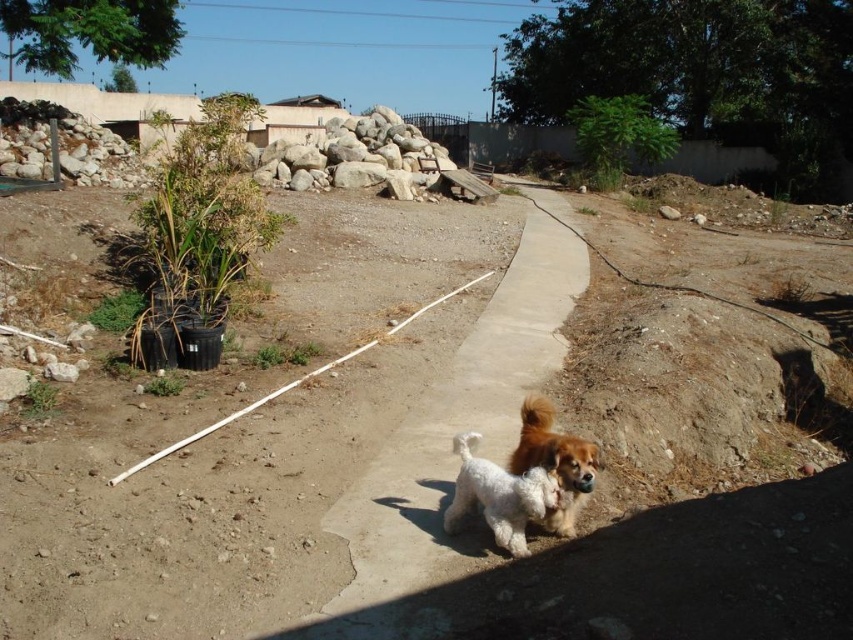
Who is more forward, (492,392) or (595,472)?

Point (595,472)

Is point (553, 266) farther from camera compared to point (535, 433)?

Yes, it is behind point (535, 433).

Locate an element on the screen. concrete at center is located at coordinates (451, 436).

Who is positioned more to the right, white fluffy dog at center or fluffy brown and white dog at center?

Positioned to the right is fluffy brown and white dog at center.

Who is taller, white fluffy dog at center or fluffy brown and white dog at center?

Standing taller between the two is fluffy brown and white dog at center.

The width and height of the screenshot is (853, 640). I want to click on white fluffy dog at center, so click(498, 496).

At what (x,y) coordinates should I click in order to perform the action: click on white fluffy dog at center. Please return your answer as a coordinate pair (x, y). Looking at the image, I should click on (498, 496).

Which of these two, dirt track at center or concrete at center, stands shorter?

Standing shorter between the two is concrete at center.

Can you confirm if dirt track at center is taller than concrete at center?

Correct, dirt track at center is much taller as concrete at center.

Image resolution: width=853 pixels, height=640 pixels. I want to click on dirt track at center, so click(421, 460).